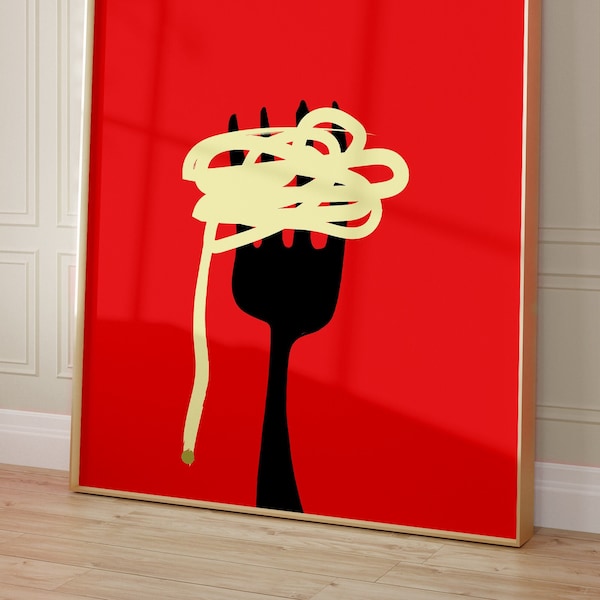
You are a GUI agent. You are given a task and a screenshot of the screen. Output one action in this format:
    pyautogui.click(x=<x>, y=<y>)
    Task: Click on the fork
    
    Given the screenshot: What is the action you would take?
    pyautogui.click(x=297, y=285)